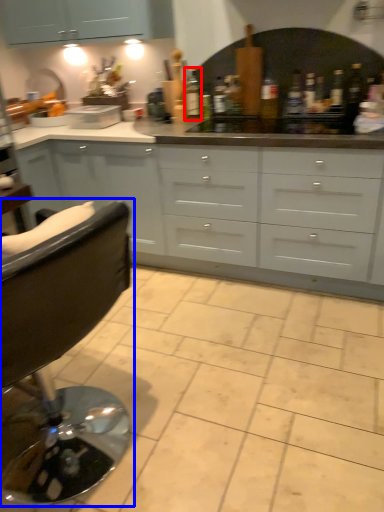
Question: Which point is closer to the camera, bottle (highlighted by a red box) or chair (highlighted by a blue box)?

Choices:
 (A) bottle
 (B) chair

Answer: (B)